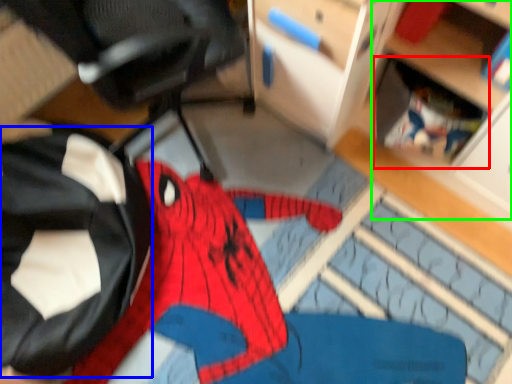
Question: Considering the real-world distances, which object is closest to shelf (highlighted by a red box)? clothing (highlighted by a blue box) or shelf (highlighted by a green box).

Choices:
 (A) clothing
 (B) shelf

Answer: (B)